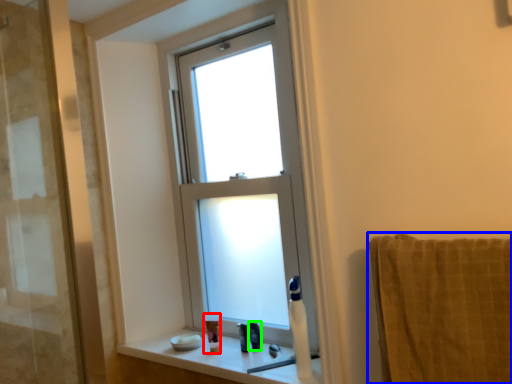
Question: Considering the real-world distances, which object is farthest from toiletry (highlighted by a red box)? towel/napkin (highlighted by a blue box) or toiletry (highlighted by a green box)?

Choices:
 (A) towel/napkin
 (B) toiletry

Answer: (A)